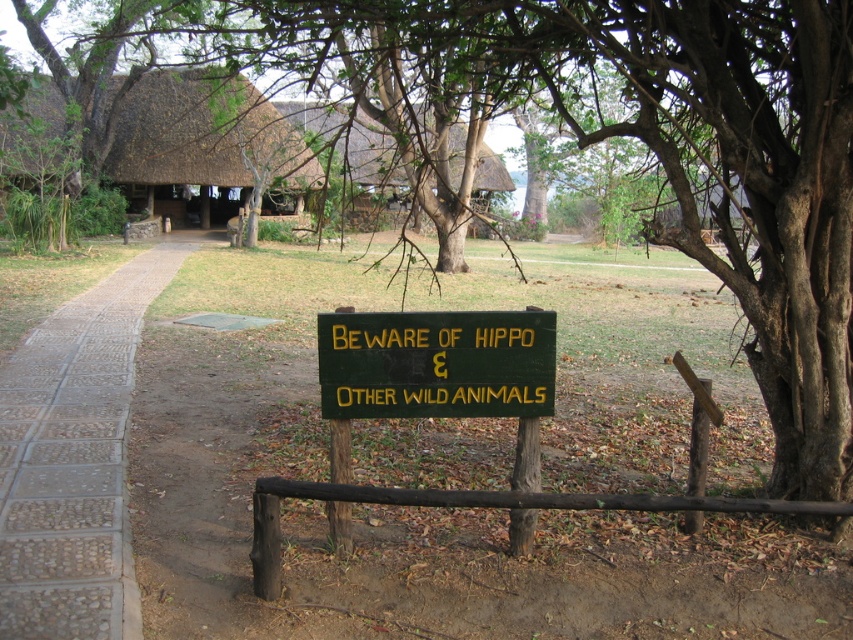
Question: Which point is farther to the camera?

Choices:
 (A) pebble stone path at left
 (B) green painted wood sign at center
 (C) thatched roof hut at upper center

Answer: (C)

Question: Which of the following is the closest to the observer?

Choices:
 (A) pebble stone path at left
 (B) green painted wood sign at center

Answer: (A)

Question: Can you confirm if pebble stone path at left is wider than thatched roof hut at upper center?

Choices:
 (A) no
 (B) yes

Answer: (A)

Question: Which point is farther to the camera?

Choices:
 (A) pebble stone path at left
 (B) thatched roof hut at upper center
 (C) green painted wood sign at center

Answer: (B)

Question: Does pebble stone path at left appear on the right side of thatched roof hut at upper center?

Choices:
 (A) no
 (B) yes

Answer: (A)

Question: Does pebble stone path at left have a greater width compared to thatched roof hut at upper center?

Choices:
 (A) yes
 (B) no

Answer: (B)